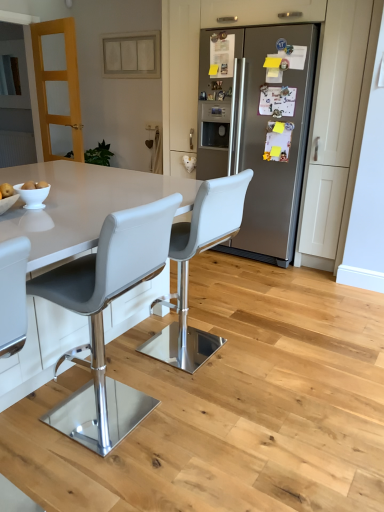
Question: Is beige matte cabinet at upper center inside or outside of white leather stool at center, which appears as the 1th chair when viewed from the back?

Choices:
 (A) outside
 (B) inside

Answer: (A)

Question: In terms of width, does beige matte cabinet at upper center look wider or thinner when compared to white leather stool at center, which is the 2th chair in front-to-back order?

Choices:
 (A) wide
 (B) thin

Answer: (B)

Question: Estimate the real-world distances between objects in this image. Which object is closer to the white leather stool at center, the second chair positioned from the back?

Choices:
 (A) yellow matte apple at lower left
 (B) beige matte cabinet at upper center
 (C) satin silver refrigerator at center
 (D) white leather stool at center, which appears as the 1th chair when viewed from the back
 (E) white glossy bowl at lower left

Answer: (D)

Question: Which object is the farthest from the yellow matte apple at lower left?

Choices:
 (A) white glossy bowl at lower left
 (B) satin silver refrigerator at center
 (C) white leather stool at center, arranged as the first chair when viewed from the front
 (D) light brown wooden door at upper left
 (E) beige matte cabinet at upper center

Answer: (E)